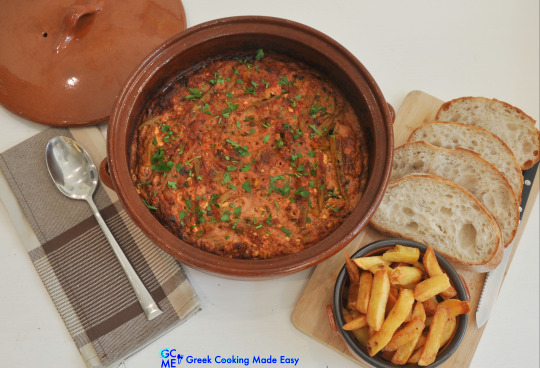
Locate an element on the screen. The width and height of the screenshot is (540, 368). spoon is located at coordinates (79, 177).